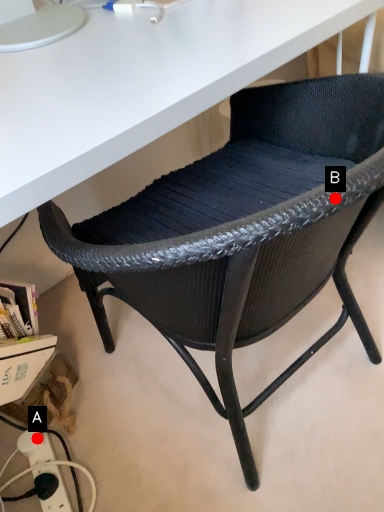
Question: Two points are circled on the image, labeled by A and B beside each circle. Among these points, which one is nearest to the camera?

Choices:
 (A) A is closer
 (B) B is closer

Answer: (B)